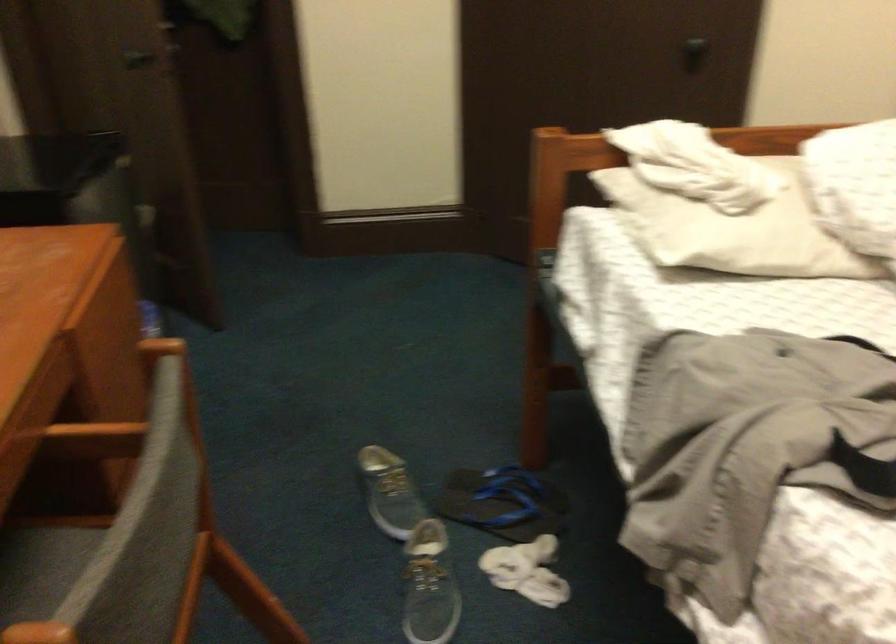
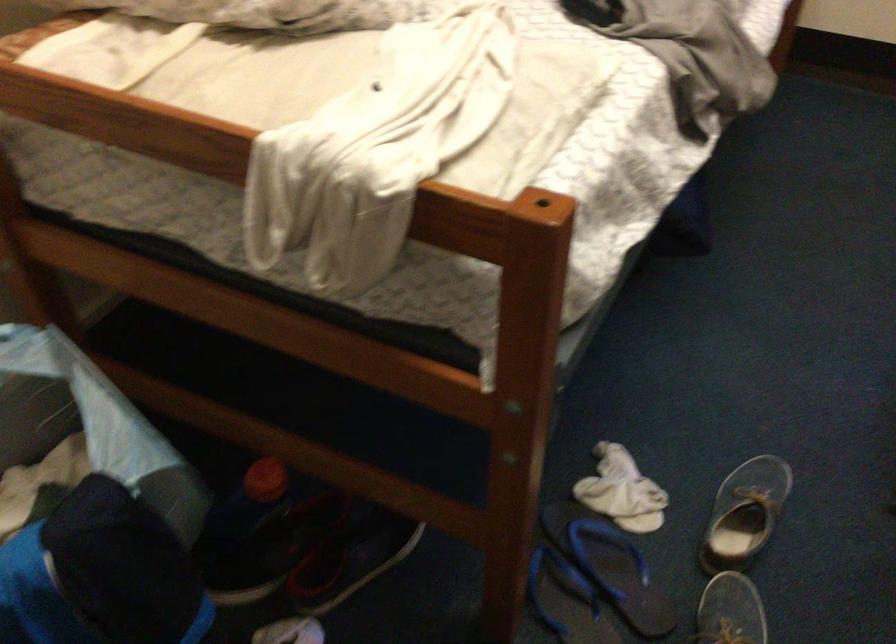
Where in the second image is the point corresponding to pixel 419 573 from the first image?

(745, 514)